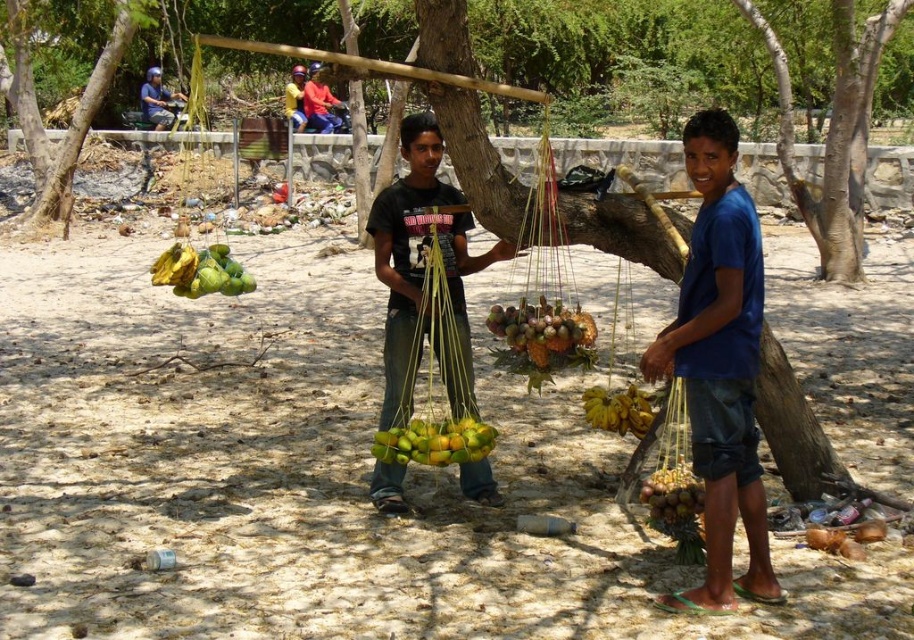
Does green leafy tree at upper left appear on the right side of shiny brown coconuts at center?

No, green leafy tree at upper left is not to the right of shiny brown coconuts at center.

Between green leafy tree at upper left and shiny brown coconuts at center, which one has more height?

With more height is green leafy tree at upper left.

The image size is (914, 640). What do you see at coordinates (72, 113) in the screenshot? I see `green leafy tree at upper left` at bounding box center [72, 113].

Where is `green leafy tree at upper left`? green leafy tree at upper left is located at coordinates (72, 113).

Is shiny brown coconuts at center to the left of brown rough coconuts at lower right from the viewer's perspective?

Indeed, shiny brown coconuts at center is positioned on the left side of brown rough coconuts at lower right.

Does shiny brown coconuts at center have a greater height compared to brown rough coconuts at lower right?

Yes, shiny brown coconuts at center is taller than brown rough coconuts at lower right.

This screenshot has height=640, width=914. In order to click on shiny brown coconuts at center in this screenshot , I will do `click(543, 333)`.

Looking at this image, does yellow matte bananas at center have a smaller size compared to blue fabric shirt at upper left?

Yes, yellow matte bananas at center is smaller than blue fabric shirt at upper left.

This screenshot has width=914, height=640. I want to click on yellow matte bananas at center, so [618, 410].

Which is in front, point (594, 388) or point (155, 109)?

Point (594, 388)

Image resolution: width=914 pixels, height=640 pixels. I want to click on yellow matte bananas at center, so click(x=618, y=410).